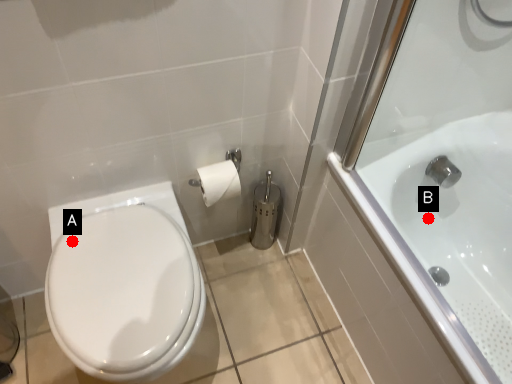
Question: Two points are circled on the image, labeled by A and B beside each circle. Which point is farther to the camera?

Choices:
 (A) A is further
 (B) B is further

Answer: (B)